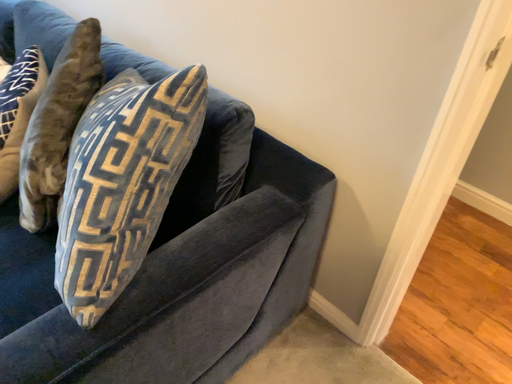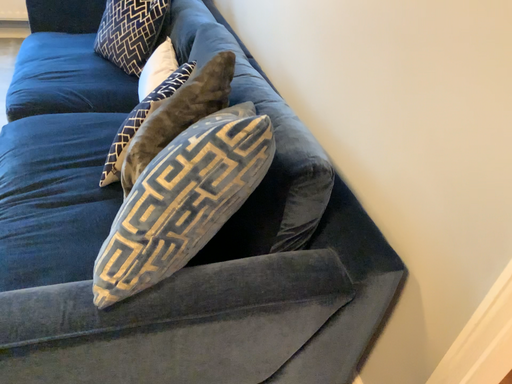
Question: Which way did the camera rotate in the video?

Choices:
 (A) rotated right
 (B) rotated left

Answer: (B)